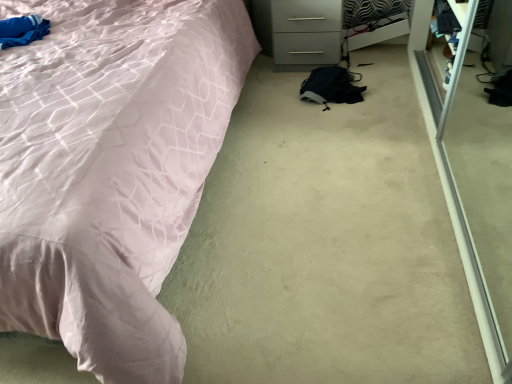
You are a GUI agent. You are given a task and a screenshot of the screen. Output one action in this format:
    pyautogui.click(x=<x>, y=<y>)
    Task: Click on the unoccupied area in front of white glossy drawer at upper right
    The width and height of the screenshot is (512, 384).
    Given the screenshot: What is the action you would take?
    pyautogui.click(x=291, y=91)